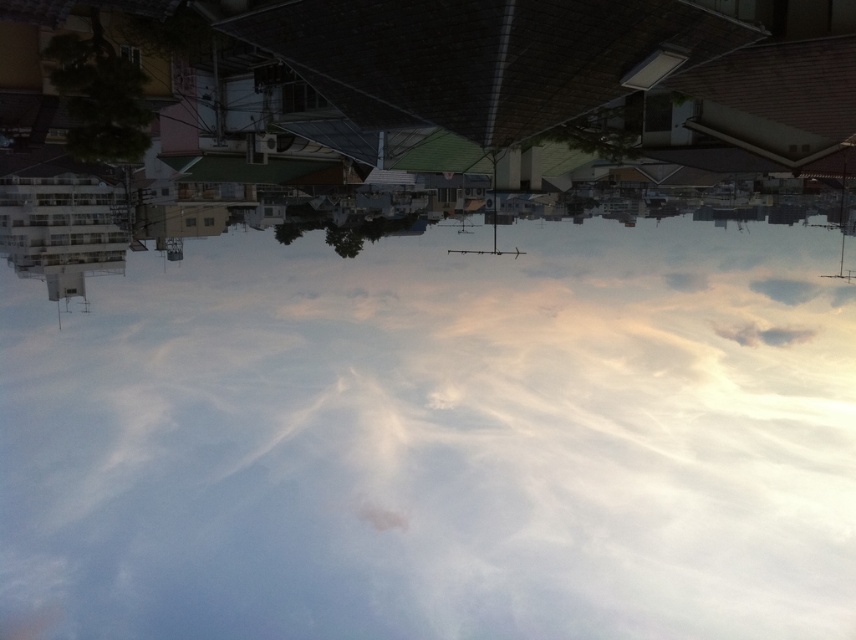
You are standing in the rotated image where the sky is at the bottom. You see the white cloud at upper center and the white fluffy cloud at upper right. Which cloud is positioned closer to you?

The white cloud at upper center is closer to the viewer than the white fluffy cloud at upper right.

You are a weather balloon operator who needs to choose a cloud to attach your balloon to. The white cloud at upper center and the white fluffy cloud at upper right are both options. Which cloud should you choose if you want the one that is bigger?

The white cloud at upper center is larger than the white fluffy cloud at upper right, so you should choose the white cloud at upper center.